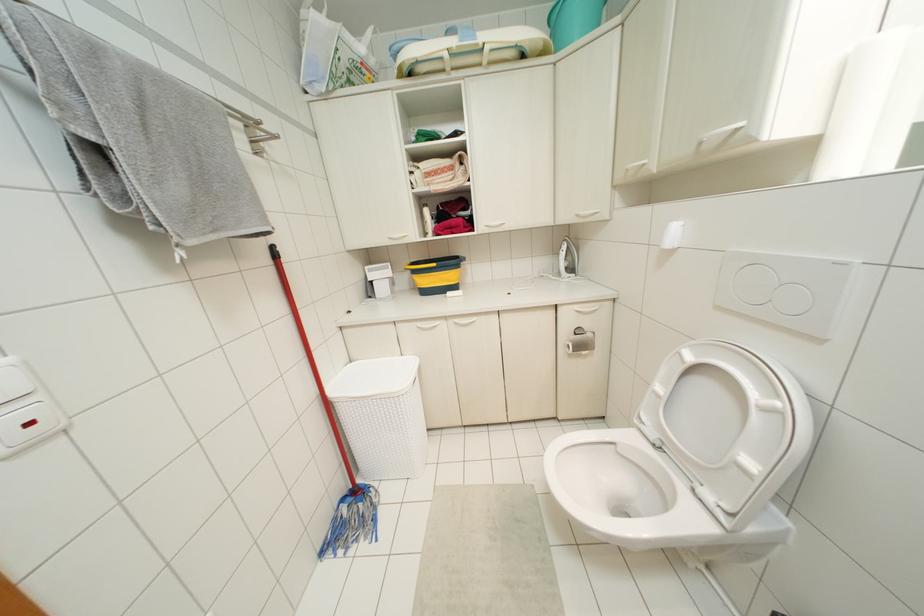
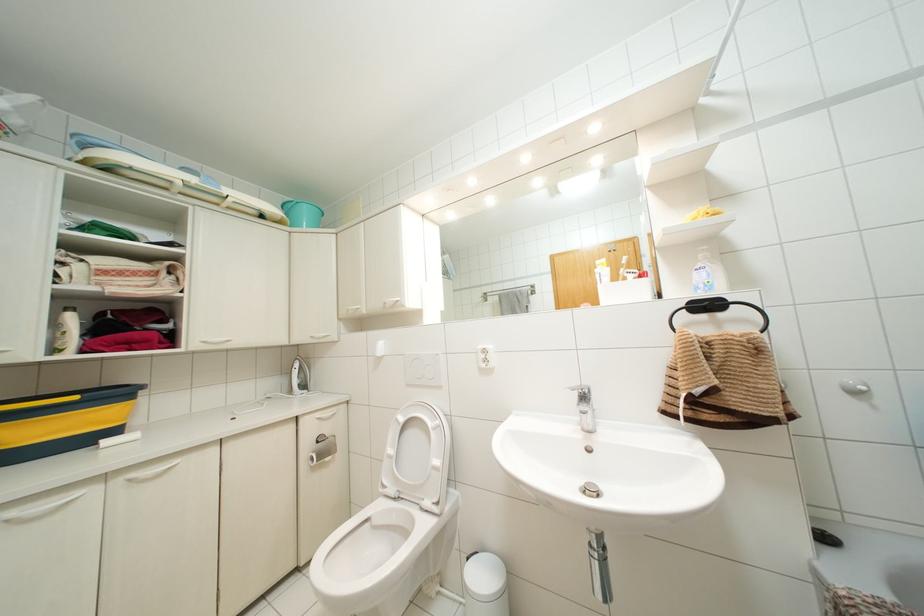
Where in the second image is the point corresponding to [426,211] from the first image?

(70, 317)